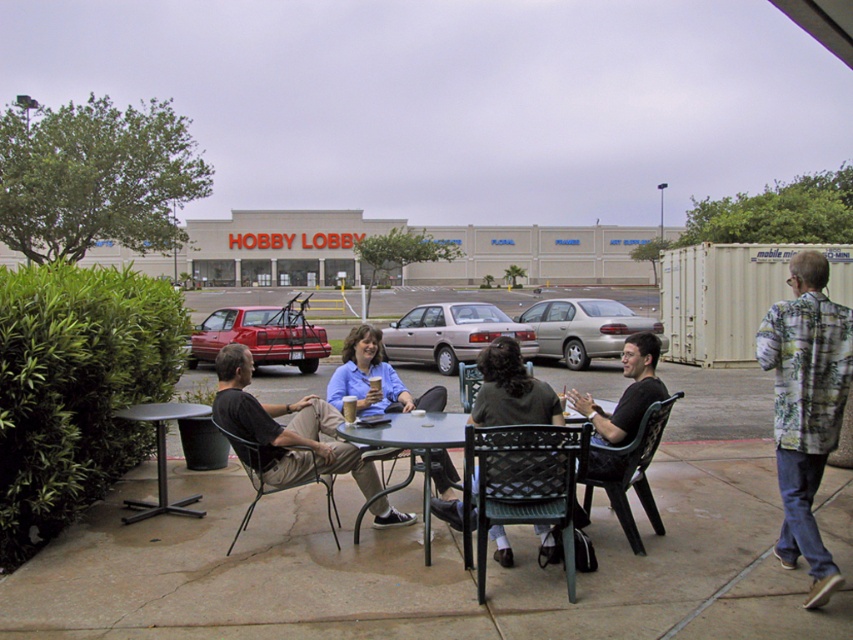
Question: Can you confirm if matte black shirt at center is positioned to the right of shiny red car at center-left?

Choices:
 (A) yes
 (B) no

Answer: (A)

Question: Considering the relative positions of shiny red car at center-left and gold metallic sedan at center in the image provided, where is shiny red car at center-left located with respect to gold metallic sedan at center?

Choices:
 (A) below
 (B) above

Answer: (B)

Question: Which of the following is the farthest from the observer?

Choices:
 (A) metallic black chair at lower left
 (B) metallic gray table at center
 (C) metallic black table at lower left

Answer: (C)

Question: Does floral shirt at right have a greater width compared to metallic gray table at center?

Choices:
 (A) yes
 (B) no

Answer: (B)

Question: Which object is the farthest from the matte black shirt at center?

Choices:
 (A) green woven metal chair at center
 (B) metallic silver car at center

Answer: (B)

Question: Which point is farther to the camera?

Choices:
 (A) metallic black chair at lower left
 (B) silver metallic sedan at center
 (C) black plastic chair at lower center
 (D) green woven chair at center

Answer: (D)